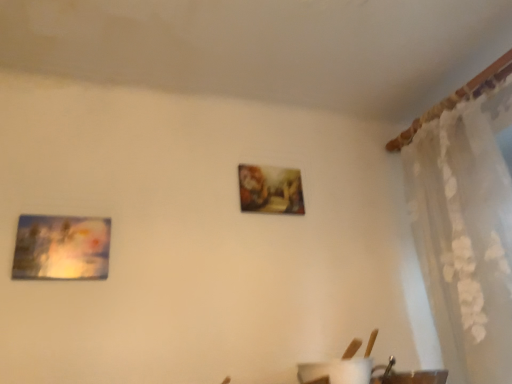
Question: Considering the positions of white sheer curtain at upper right and matte plastic picture frame at left in the image, is white sheer curtain at upper right wider or thinner than matte plastic picture frame at left?

Choices:
 (A) thin
 (B) wide

Answer: (B)

Question: Does point (480, 244) appear closer or farther from the camera than point (30, 233)?

Choices:
 (A) closer
 (B) farther

Answer: (B)

Question: In the image, is white sheer curtain at upper right on the left side or the right side of matte plastic picture frame at left?

Choices:
 (A) right
 (B) left

Answer: (A)

Question: In terms of height, does matte plastic picture frame at left look taller or shorter compared to white sheer curtain at upper right?

Choices:
 (A) tall
 (B) short

Answer: (B)

Question: Is matte plastic picture frame at left in front of or behind white sheer curtain at upper right in the image?

Choices:
 (A) front
 (B) behind

Answer: (B)

Question: Is matte plastic picture frame at left to the left or to the right of white sheer curtain at upper right in the image?

Choices:
 (A) right
 (B) left

Answer: (B)

Question: Looking at their shapes, would you say matte plastic picture frame at left is wider or thinner than white sheer curtain at upper right?

Choices:
 (A) thin
 (B) wide

Answer: (A)